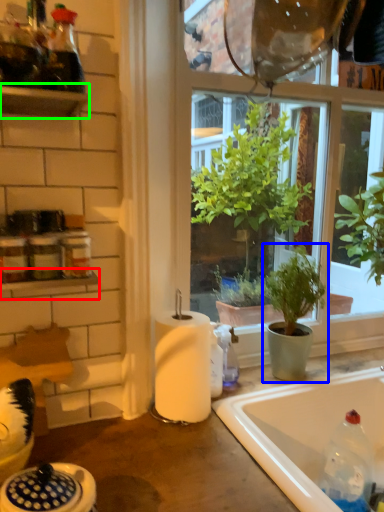
Question: Considering the real-world distances, which object is farthest from window sill (highlighted by a red box)? houseplant (highlighted by a blue box) or shelf (highlighted by a green box)?

Choices:
 (A) houseplant
 (B) shelf

Answer: (A)